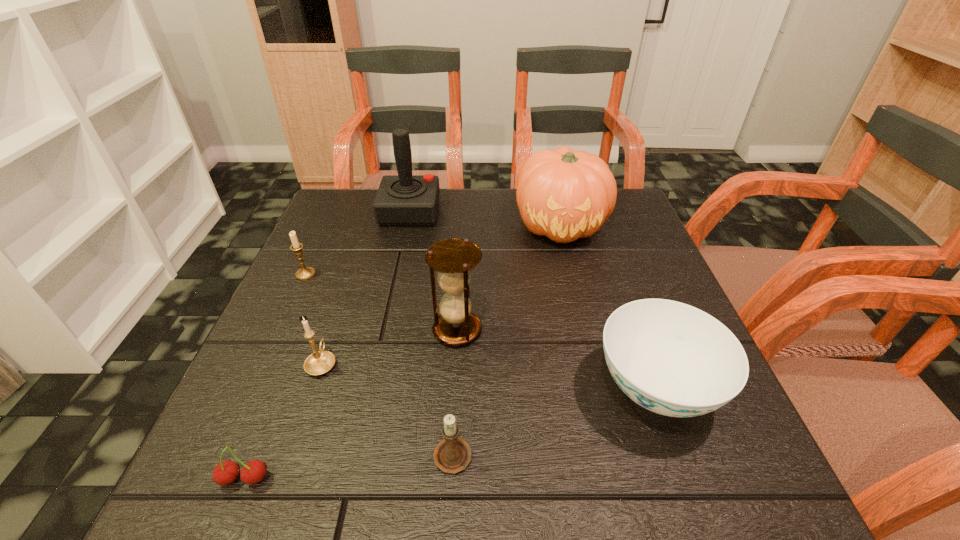
Where is `joystick`? joystick is located at coordinates (402, 200).

Identify the location of pumpkin. (564, 195).

Find the location of `hourglass`. hourglass is located at coordinates (456, 326).

Identify the location of the second candle holder from right to left. This screenshot has width=960, height=540. (320, 362).

Locate an element on the screen. The width and height of the screenshot is (960, 540). the leftmost candle holder is located at coordinates (305, 273).

Locate an element on the screen. This screenshot has width=960, height=540. the farthest candle holder is located at coordinates (305, 273).

This screenshot has width=960, height=540. I want to click on chinaware, so click(671, 358).

Image resolution: width=960 pixels, height=540 pixels. I want to click on the nearest candle holder, so click(x=452, y=455).

I want to click on cherry, so click(226, 472).

The image size is (960, 540). What are the coordinates of `free space located 0.340m on the base of the joystick` in the screenshot? It's located at (561, 211).